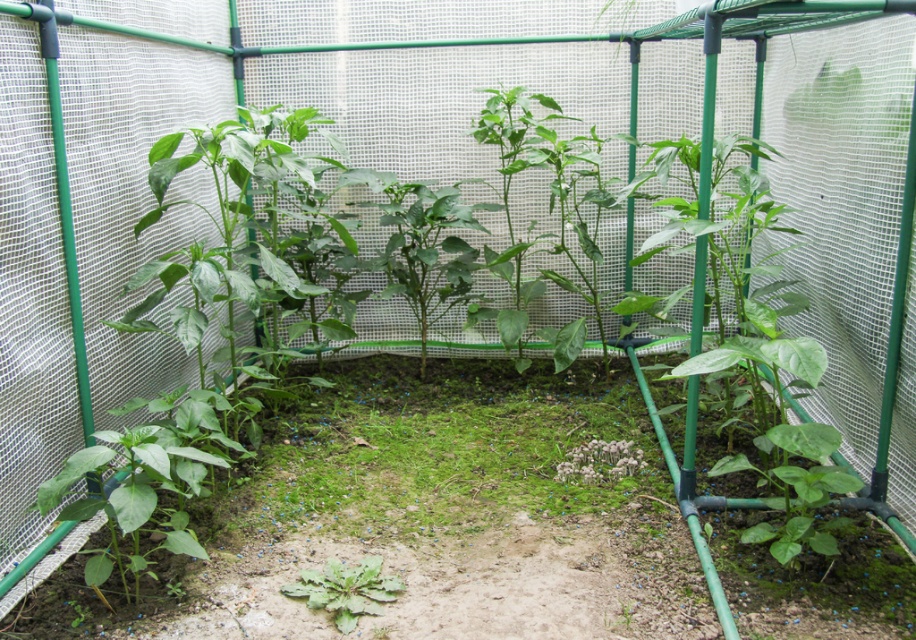
You are a gardener who wants to transplant the green mossy grass at center and the green matte plant at center to a new pot. Since you have limited space, you need to know which one is larger to prioritize. Which plant is bigger?

The green mossy grass at center is bigger than the green matte plant at center, so you should prioritize transplanting the green mossy grass at center first due to its larger size.

You are a gardener who wants to water the green mossy grass at center and the green matte plant at center. Since both are at the center, how can you distinguish which one is to the right?

The green mossy grass at center is to the right of the green matte plant at center, so you can identify the one on the right as the green mossy grass at center.